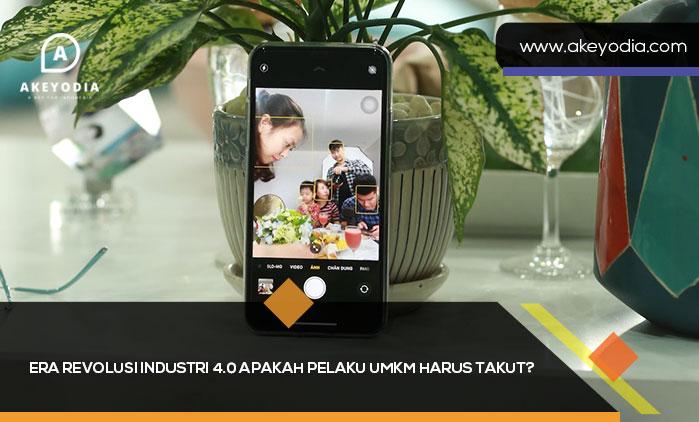
I want to click on plant pot, so click(419, 199).